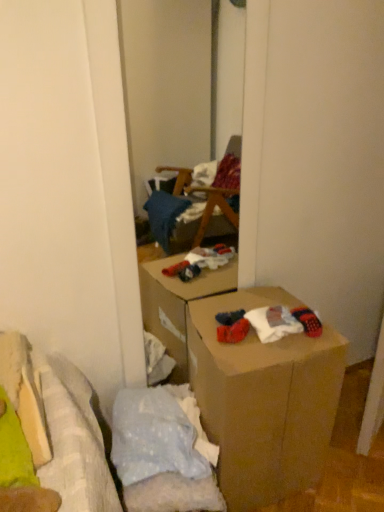
Question: Could you tell me if knitted wool socks at lower right is turned towards brown cardboard box at center?

Choices:
 (A) no
 (B) yes

Answer: (B)

Question: Is knitted wool socks at lower right further to camera compared to brown cardboard box at center?

Choices:
 (A) yes
 (B) no

Answer: (A)

Question: Does knitted wool socks at lower right have a lesser width compared to brown cardboard box at center?

Choices:
 (A) yes
 (B) no

Answer: (A)

Question: Can you confirm if knitted wool socks at lower right is positioned to the right of brown cardboard box at center?

Choices:
 (A) no
 (B) yes

Answer: (B)

Question: Is knitted wool socks at lower right outside brown cardboard box at center?

Choices:
 (A) no
 (B) yes

Answer: (A)

Question: Is knitted wool socks at lower right looking in the opposite direction of brown cardboard box at center?

Choices:
 (A) no
 (B) yes

Answer: (B)

Question: Considering the relative sizes of brown cardboard box at center and knitted wool socks at lower right in the image provided, is brown cardboard box at center smaller than knitted wool socks at lower right?

Choices:
 (A) yes
 (B) no

Answer: (B)

Question: Does brown cardboard box at center have a larger size compared to knitted wool socks at lower right?

Choices:
 (A) yes
 (B) no

Answer: (A)

Question: From the image's perspective, would you say brown cardboard box at center is shown under knitted wool socks at lower right?

Choices:
 (A) no
 (B) yes

Answer: (B)

Question: From a real-world perspective, is brown cardboard box at center physically below knitted wool socks at lower right?

Choices:
 (A) no
 (B) yes

Answer: (B)

Question: From the image's perspective, is brown cardboard box at center above knitted wool socks at lower right?

Choices:
 (A) no
 (B) yes

Answer: (A)

Question: Would you say brown cardboard box at center is outside knitted wool socks at lower right?

Choices:
 (A) no
 (B) yes

Answer: (B)

Question: From the image's perspective, is knitted wool socks at lower right positioned above or below brown cardboard box at center?

Choices:
 (A) below
 (B) above

Answer: (B)